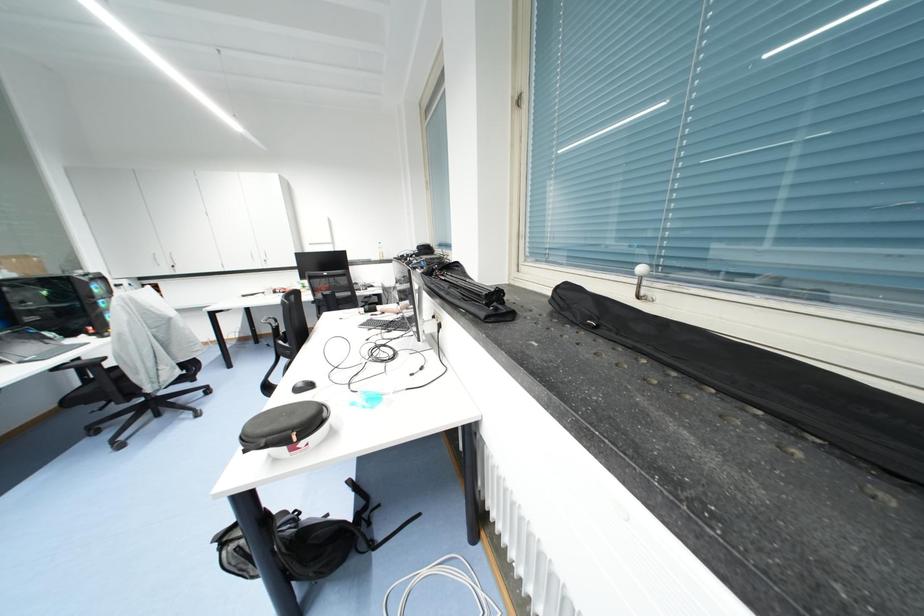
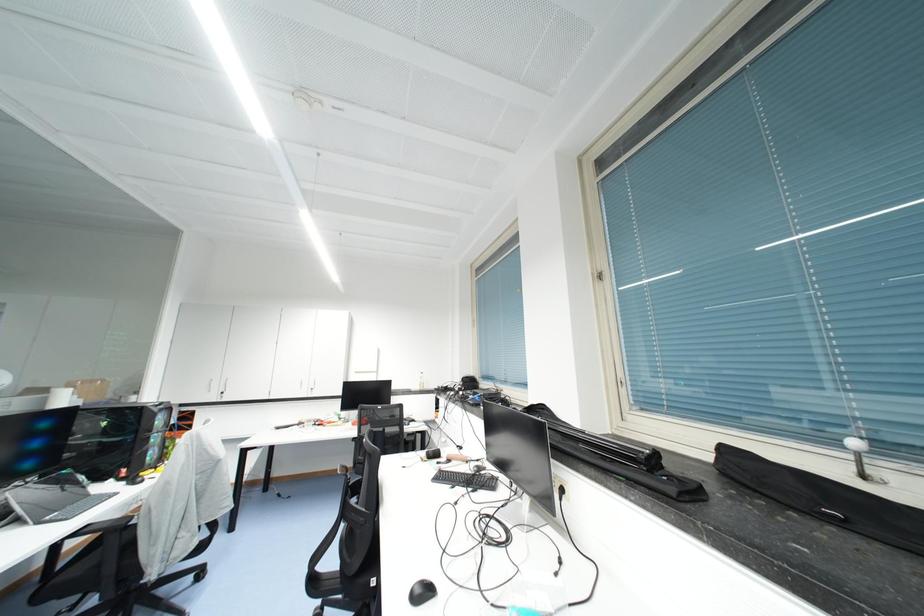
Question: Based on the continuous images, in which direction is the camera rotating? Reply with the corresponding letter.

Choices:
 (A) Left
 (B) Right
 (C) Up
 (D) Down

Answer: (C)